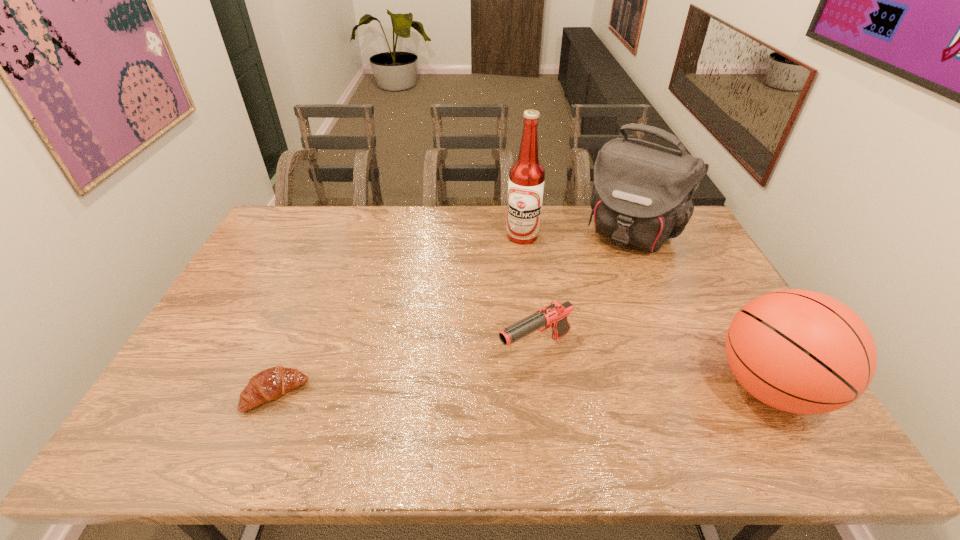
You are a GUI agent. You are given a task and a screenshot of the screen. Output one action in this format:
    pyautogui.click(x=<x>, y=<y>)
    Task: Click on the free space located at the aiming end of the fourth tallest object
    The width and height of the screenshot is (960, 540).
    Given the screenshot: What is the action you would take?
    click(438, 399)

The width and height of the screenshot is (960, 540). I want to click on vacant area situated on the label side of the alcohol, so click(527, 267).

You are a GUI agent. You are given a task and a screenshot of the screen. Output one action in this format:
    pyautogui.click(x=<x>, y=<y>)
    Task: Click on the blank area located 0.400m on the label side of the alcohol
    This screenshot has width=960, height=540.
    Given the screenshot: What is the action you would take?
    pyautogui.click(x=537, y=331)

The image size is (960, 540). I want to click on vacant space located 0.260m on the label side of the alcohol, so tap(532, 296).

The height and width of the screenshot is (540, 960). In order to click on vacant space located 0.280m on the open flap of the shoulder bag in this screenshot , I will do `click(581, 307)`.

Identify the location of vacant space located on the open flap of the shoulder bag. The width and height of the screenshot is (960, 540). (609, 266).

At what (x,y) coordinates should I click in order to perform the action: click on free point located on the open flap of the shoulder bag. Please return your answer as a coordinate pair (x, y). The height and width of the screenshot is (540, 960). Looking at the image, I should click on (602, 275).

Where is `alcohol at the far edge`? alcohol at the far edge is located at coordinates (526, 182).

At what (x,y) coordinates should I click in order to perform the action: click on shoulder bag at the far edge. Please return your answer as a coordinate pair (x, y). The width and height of the screenshot is (960, 540). Looking at the image, I should click on pyautogui.click(x=642, y=194).

This screenshot has width=960, height=540. In order to click on crescent roll that is at the near edge in this screenshot , I will do `click(269, 384)`.